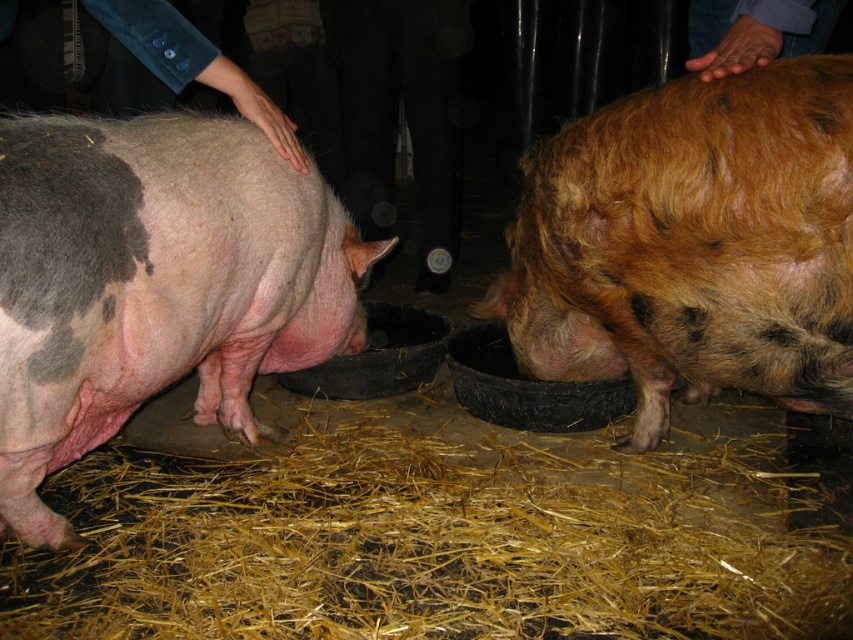
How distant is yellow straw at lower center from speckled pink pig at left?

Answer: yellow straw at lower center and speckled pink pig at left are 62.97 centimeters apart from each other.

Can you confirm if yellow straw at lower center is positioned to the right of speckled pink pig at left?

Yes, yellow straw at lower center is to the right of speckled pink pig at left.

What do you see at coordinates (440, 540) in the screenshot?
I see `yellow straw at lower center` at bounding box center [440, 540].

Locate an element on the screen. Image resolution: width=853 pixels, height=640 pixels. yellow straw at lower center is located at coordinates pyautogui.click(x=440, y=540).

Between speckled pink pig at left and brown fuzzy pig at center, which one appears on the right side from the viewer's perspective?

From the viewer's perspective, brown fuzzy pig at center appears more on the right side.

Measure the distance between speckled pink pig at left and camera.

speckled pink pig at left is 1.45 meters away from camera.

Between point (38, 193) and point (660, 257), which one is positioned in front?

Point (38, 193) is in front.

Where is `speckled pink pig at left`? speckled pink pig at left is located at coordinates (154, 284).

How much distance is there between yellow straw at lower center and brown fuzzy pig at center?

A distance of 66.22 centimeters exists between yellow straw at lower center and brown fuzzy pig at center.

Between yellow straw at lower center and brown fuzzy pig at center, which one is positioned higher?

Result: brown fuzzy pig at center is higher up.

The image size is (853, 640). Describe the element at coordinates (440, 540) in the screenshot. I see `yellow straw at lower center` at that location.

I want to click on yellow straw at lower center, so tap(440, 540).